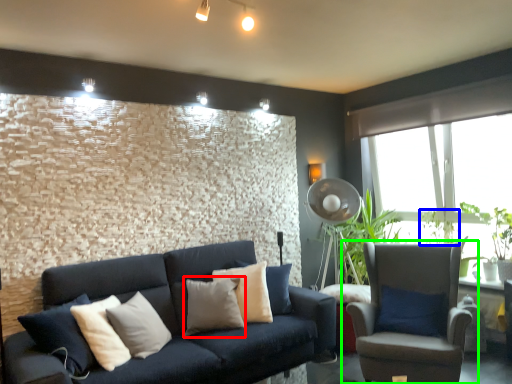
Question: Which object is positioned closest to pillow (highlighted by a red box)? Select from plant (highlighted by a blue box) and chair (highlighted by a green box).

Choices:
 (A) plant
 (B) chair

Answer: (B)